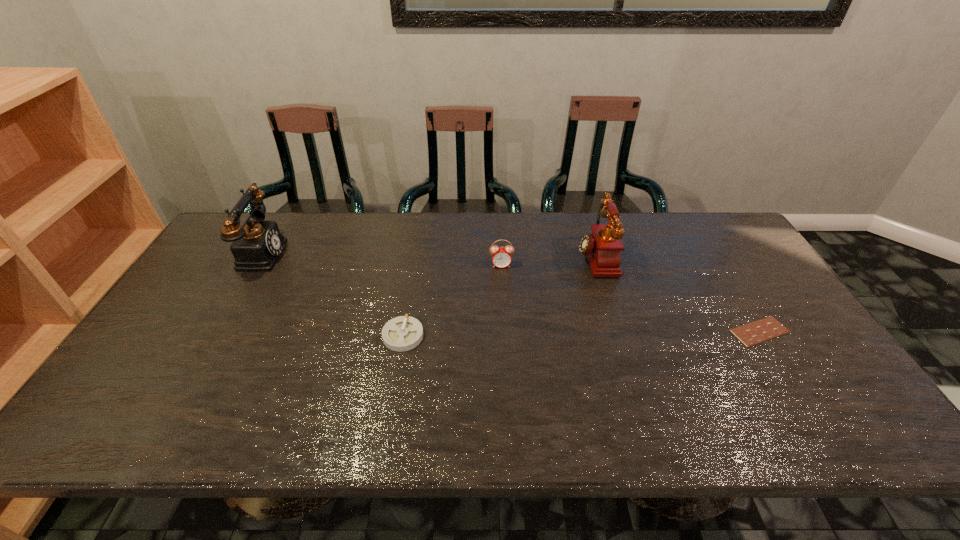
Find the location of a particular element. The height and width of the screenshot is (540, 960). free area in between the left telephone and the alarm clock is located at coordinates (380, 259).

Locate an element on the screen. This screenshot has height=540, width=960. vacant space in between the second object from left to right and the third shortest object is located at coordinates (452, 300).

The width and height of the screenshot is (960, 540). Find the location of `vacant space that is in between the fourth object from right to left and the left telephone`. vacant space that is in between the fourth object from right to left and the left telephone is located at coordinates (331, 294).

Locate which object is the closest to the ashtray. Please provide its 2D coordinates. Your answer should be formatted as a tuple, i.e. [(x, y)], where the tuple contains the x and y coordinates of a point satisfying the conditions above.

[(501, 257)]

Where is `the fourth closest object to the right telephone`? the fourth closest object to the right telephone is located at coordinates (256, 246).

You are a GUI agent. You are given a task and a screenshot of the screen. Output one action in this format:
    pyautogui.click(x=<x>, y=<y>)
    Task: Click on the vacant point that satisfies the following two spatial constraints: 1. on the clock face of the rightmost object; 2. on the left side of the third object from right to left
    The width and height of the screenshot is (960, 540).
    Given the screenshot: What is the action you would take?
    pyautogui.click(x=505, y=332)

At what (x,y) coordinates should I click in order to perform the action: click on free location that satisfies the following two spatial constraints: 1. on the dial of the second object from right to left; 2. on the clock face of the third object from right to left. Please return your answer as a coordinate pair (x, y). The width and height of the screenshot is (960, 540). Looking at the image, I should click on (597, 265).

In order to click on blank space that satisfies the following two spatial constraints: 1. on the dial of the fourth object from left to right; 2. on the back side of the shortest object in this screenshot , I will do [617, 332].

This screenshot has width=960, height=540. I want to click on free space in the image that satisfies the following two spatial constraints: 1. on the front of the second object from left to right at the rotary dial; 2. on the right side of the left telephone, so click(210, 336).

Where is `blank space that satisfies the following two spatial constraints: 1. on the back side of the chocolate bar; 2. on the front of the left telephone at the rotary dial`? blank space that satisfies the following two spatial constraints: 1. on the back side of the chocolate bar; 2. on the front of the left telephone at the rotary dial is located at coordinates (711, 253).